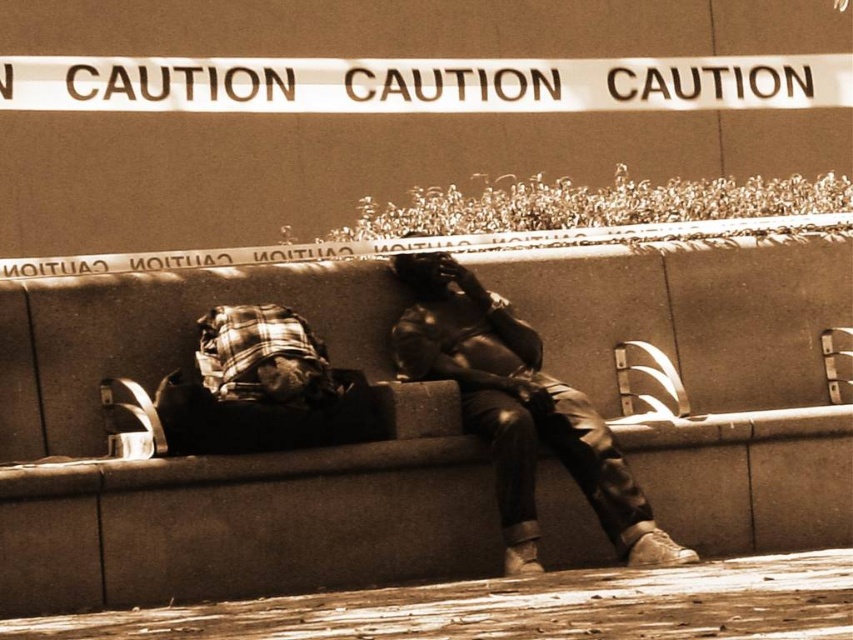
Question: Among these points, which one is farthest from the camera?

Choices:
 (A) (466, 353)
 (B) (119, 440)
 (C) (270, 532)

Answer: (A)

Question: Does matte black jacket at center have a lesser width compared to plaid fabric bag at lower left?

Choices:
 (A) yes
 (B) no

Answer: (B)

Question: Does smooth concrete bench at center come in front of matte black jacket at center?

Choices:
 (A) no
 (B) yes

Answer: (A)

Question: Can you confirm if smooth concrete bench at center is positioned to the left of plaid fabric bag at lower left?

Choices:
 (A) no
 (B) yes

Answer: (A)

Question: Which of these objects is positioned farthest from the smooth concrete bench at center?

Choices:
 (A) matte black jacket at center
 (B) plaid fabric bag at lower left

Answer: (B)

Question: Which object is closer to the camera taking this photo?

Choices:
 (A) smooth concrete bench at center
 (B) plaid fabric bag at lower left
 (C) matte black jacket at center

Answer: (C)